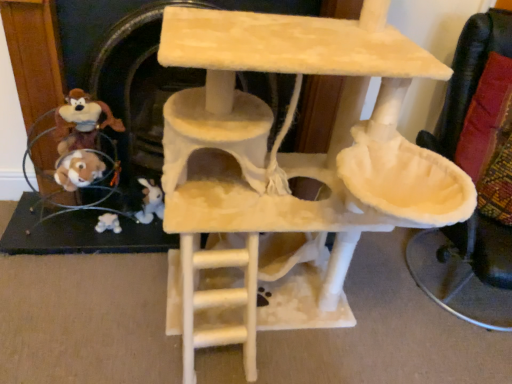
Locate an element on the screen. The height and width of the screenshot is (384, 512). vacant area located to the right-hand side of white plush toy at lower left, which is the second toy in front-to-back order is located at coordinates (150, 250).